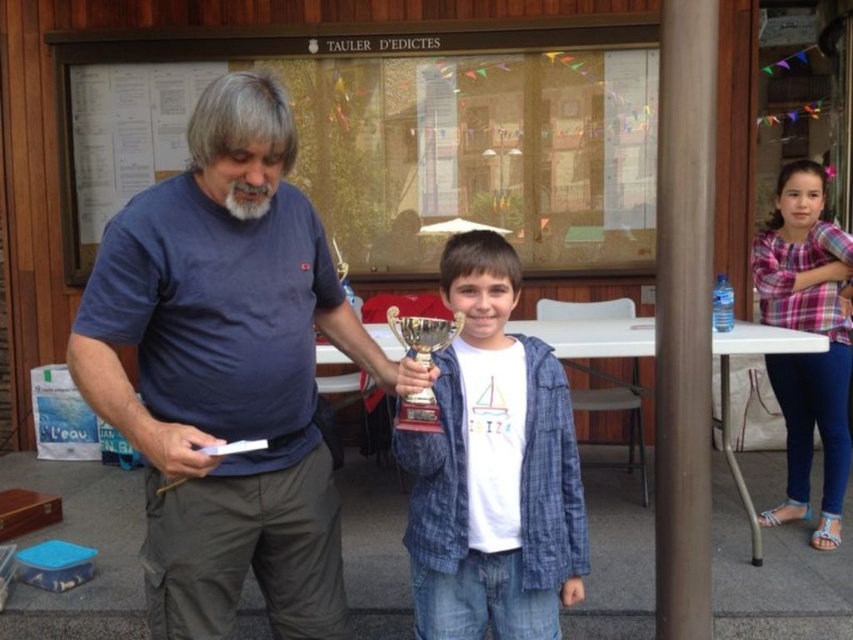
Find the location of a particular element. The height and width of the screenshot is (640, 853). plaid shirt at right is located at coordinates (809, 332).

Who is shorter, plaid shirt at right or grayhairbeard at center?

grayhairbeard at center

Is point (842, 260) positioned after point (267, 204)?

Yes.

At what (x,y) coordinates should I click in order to perform the action: click on plaid shirt at right. Please return your answer as a coordinate pair (x, y). Looking at the image, I should click on (809, 332).

Is blue cotton shirt at center shorter than gold metallic trophy at center?

No.

Does point (177, 554) lie in front of point (399, 330)?

Yes, it is.

Where is `blue cotton shirt at center`? This screenshot has height=640, width=853. blue cotton shirt at center is located at coordinates (227, 374).

Measure the distance between gold metallic trophy at center and grayhairbeard at center.

16.15 inches

Does gold metallic trophy at center have a greater width compared to grayhairbeard at center?

Yes.

What do you see at coordinates (422, 333) in the screenshot? I see `gold metallic trophy at center` at bounding box center [422, 333].

I want to click on gold metallic trophy at center, so click(x=422, y=333).